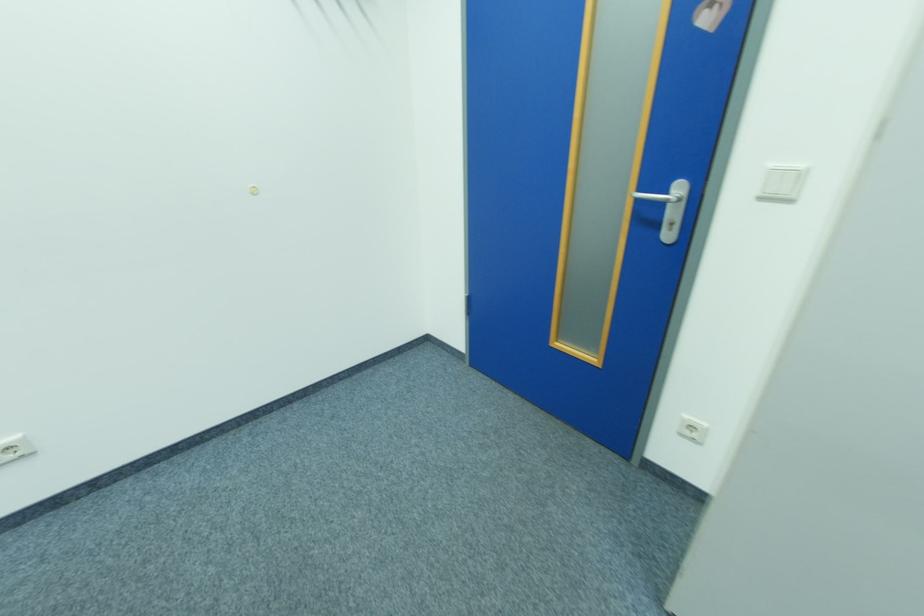
Find where to push the white light switch. Please return your answer as a coordinate pair (x, y).

(691, 429)